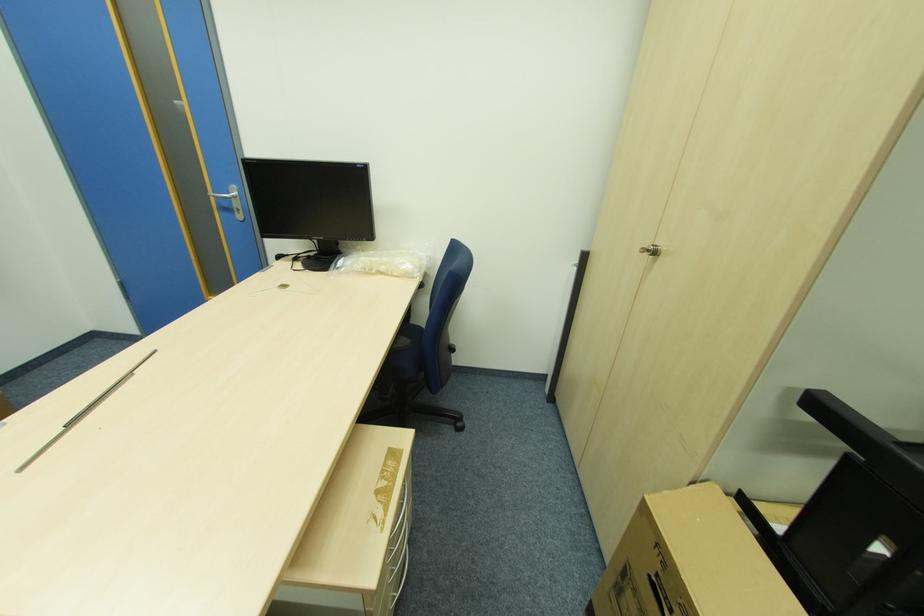
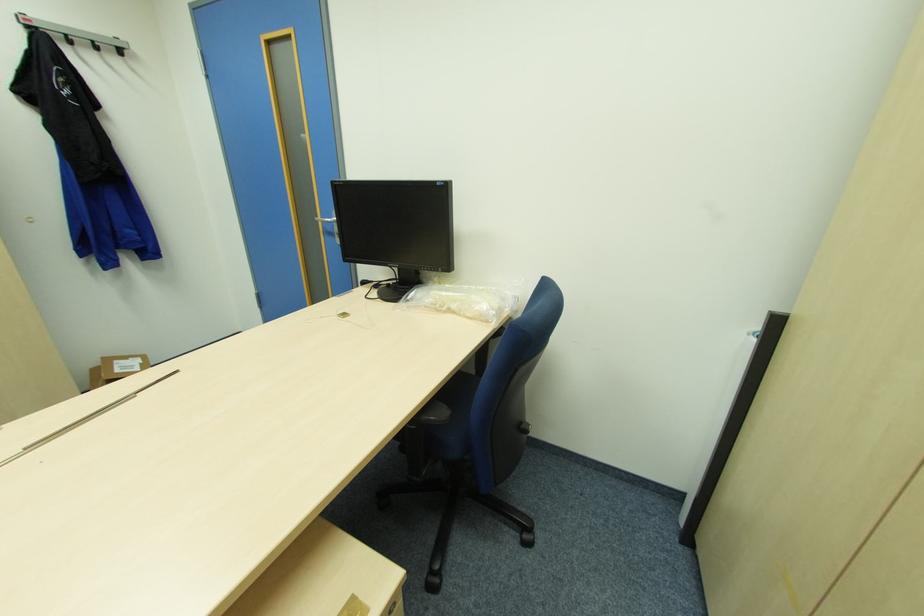
Question: The images are taken continuously from a first-person perspective. In which direction is your viewpoint rotating?

Choices:
 (A) Left
 (B) Right
 (C) Up
 (D) Down

Answer: (A)